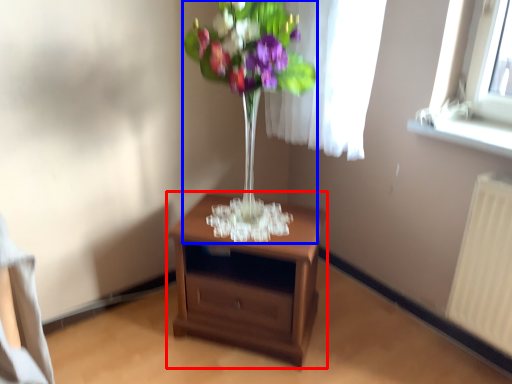
Question: Which point is closer to the camera, nightstand (highlighted by a red box) or floral arrangement (highlighted by a blue box)?

Choices:
 (A) nightstand
 (B) floral arrangement

Answer: (B)